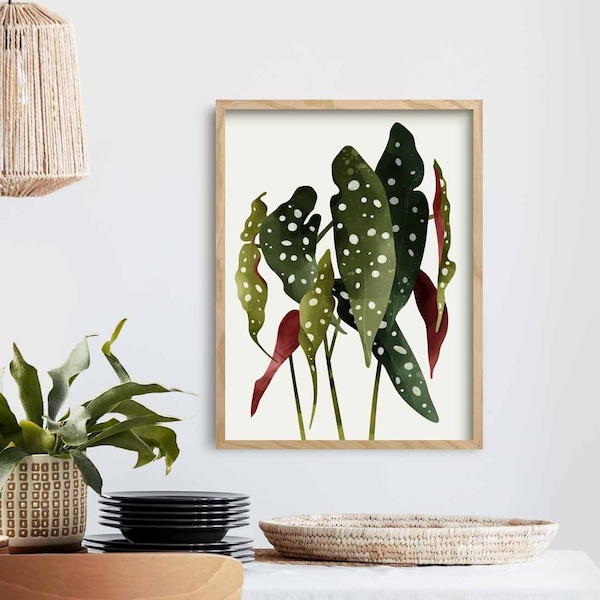
You are a GUI agent. You are given a task and a screenshot of the screen. Output one action in this format:
    pyautogui.click(x=<x>, y=<y>)
    Task: Click on the plant
    This screenshot has width=600, height=600.
    Given the screenshot: What is the action you would take?
    pyautogui.click(x=91, y=407)